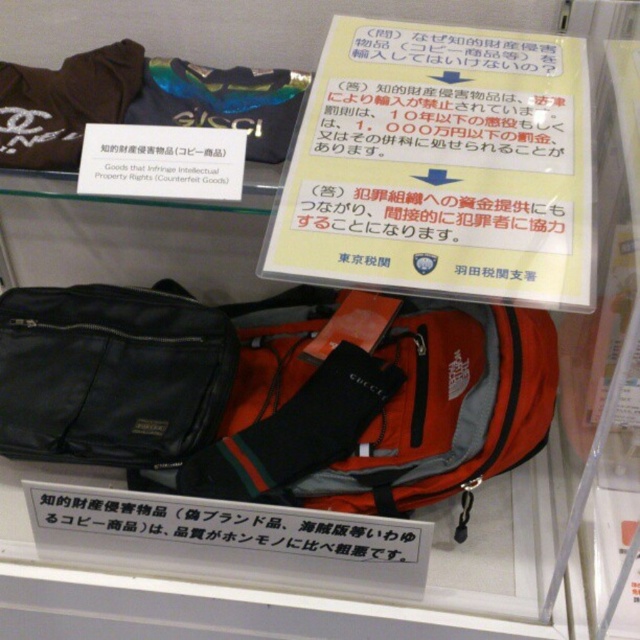
You are a visitor at the exhibit and want to read the yellow paper at upper center but are blocked by the orange fabric backpack at center. Can you move the backpack to access the paper?

The yellow paper at upper center is in front of the orange fabric backpack at center, meaning it is already positioned in a way that you can read it without moving the backpack.

You are a visitor at the exhibit and want to compare the size of the orange fabric backpack at center and the white paper sign at center. Which one is bigger?

The orange fabric backpack at center is larger in size than the white paper sign at center.

You are a visitor at the exhibit and want to read the white paper sign at center. You are currently holding the orange fabric backpack at center. Can you read the sign without moving the backpack?

The orange fabric backpack at center is 5.31 inches away from the white paper sign at center, so you can read the white paper sign at center without moving the backpack since they are not touching.